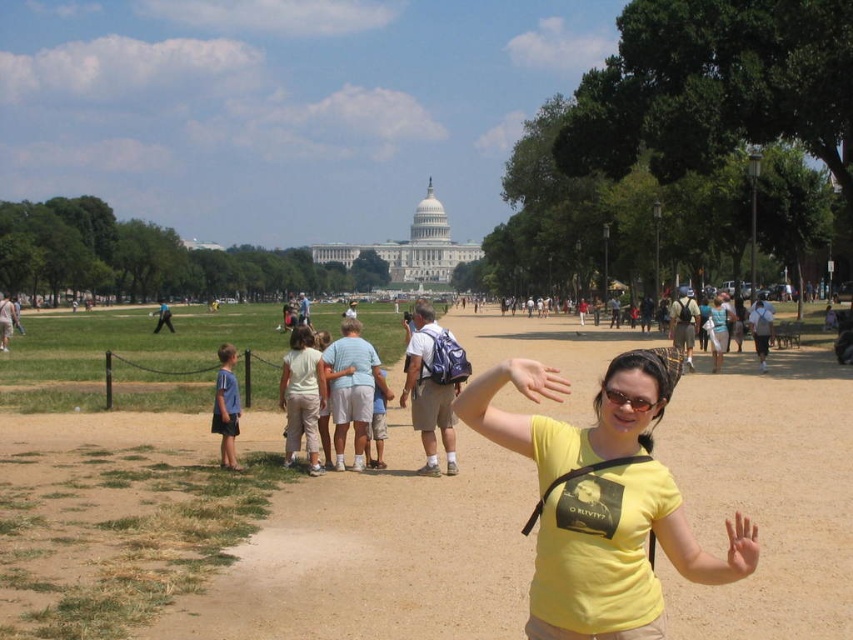
Question: Which point appears closest to the camera in this image?

Choices:
 (A) (608, 400)
 (B) (566, 392)
 (C) (570, 440)

Answer: (B)

Question: Among these points, which one is farthest from the camera?

Choices:
 (A) pos(515,368)
 (B) pos(606,397)
 (C) pos(662,541)

Answer: (B)

Question: Among these objects, which one is nearest to the camera?

Choices:
 (A) matte black sunglasses at center
 (B) yellow t-shirt at center
 (C) matte yellow t-shirt at center

Answer: (B)

Question: Does yellow t-shirt at center have a smaller size compared to matte yellow t-shirt at center?

Choices:
 (A) no
 (B) yes

Answer: (A)

Question: Does yellow t-shirt at center appear under matte yellow t-shirt at center?

Choices:
 (A) no
 (B) yes

Answer: (B)

Question: Does yellow t-shirt at center come in front of matte black sunglasses at center?

Choices:
 (A) yes
 (B) no

Answer: (A)